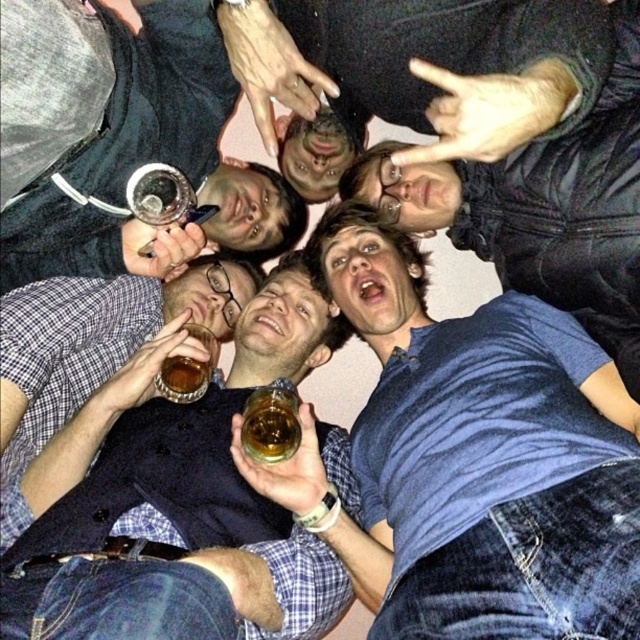
Question: Which point is farther to the camera?

Choices:
 (A) (280, 456)
 (B) (528, 340)
 (C) (396, 113)

Answer: (C)

Question: Among these objects, which one is nearest to the camera?

Choices:
 (A) brushed metal wine glass at upper left
 (B) blue denim shirt at center
 (C) translucent glass cup at center

Answer: (B)

Question: In this image, where is brushed metal wine glass at upper left located relative to translucent amber liquid at center?

Choices:
 (A) left
 (B) right

Answer: (A)

Question: Which point appears closest to the camera in this image?

Choices:
 (A) (29, 10)
 (B) (321, 36)
 (C) (205, 388)

Answer: (A)

Question: Is brushed metal wine glass at upper left above translucent amber liquid at center?

Choices:
 (A) no
 (B) yes

Answer: (B)

Question: Can you confirm if brushed metal wine glass at upper left is positioned to the right of translucent glass cup at center?

Choices:
 (A) no
 (B) yes

Answer: (A)